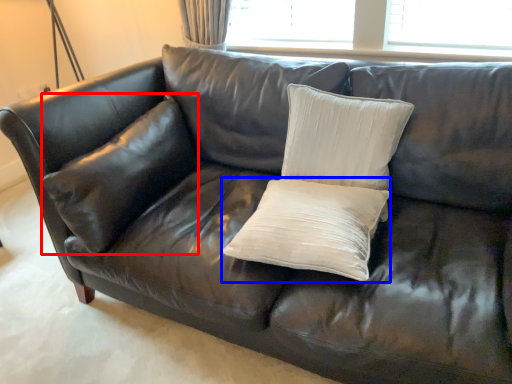
Question: Among these objects, which one is farthest to the camera, pillow (highlighted by a red box) or pillow (highlighted by a blue box)?

Choices:
 (A) pillow
 (B) pillow

Answer: (A)